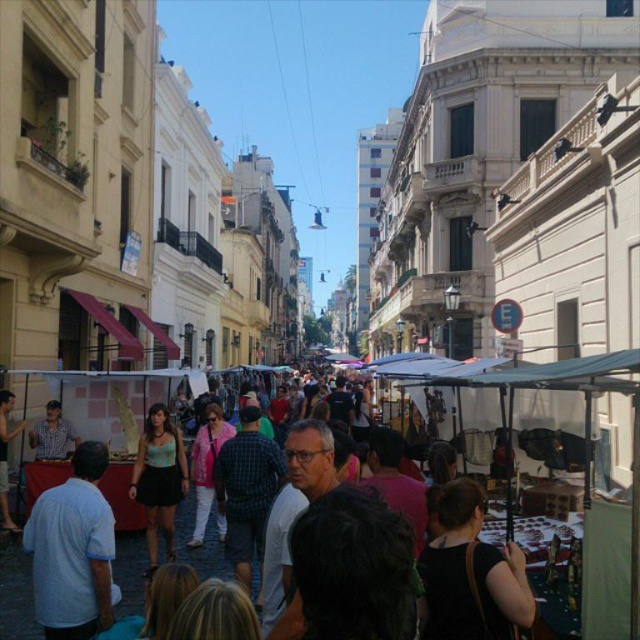
You are a customer in this market and you see the matte black dress at center and the matte black shirt at left. Which clothing item is located to the right of the other?

The matte black dress at center is positioned on the right side of the matte black shirt at left, so the dress is to the right of the shirt.

You are a street vendor at the lively market and need to decide which item to display first. You have a matte black dress at center and a matte black shirt at center. Based on their sizes, which one should you place on the front table to attract more attention?

The matte black dress at center might be wider than the matte black shirt at center, so placing the dress first could be more eye catching due to its larger size.

You are a customer at this street market and see both the matte black dress at center and the matte black shirt at center. Which item would you need a larger storage space for in your bag?

The matte black dress at center has a larger size compared to the matte black shirt at center, so it would require more storage space in your bag.